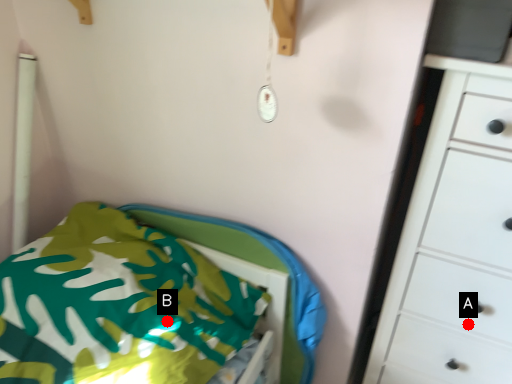
Question: Two points are circled on the image, labeled by A and B beside each circle. Which point is farther to the camera?

Choices:
 (A) A is further
 (B) B is further

Answer: (A)